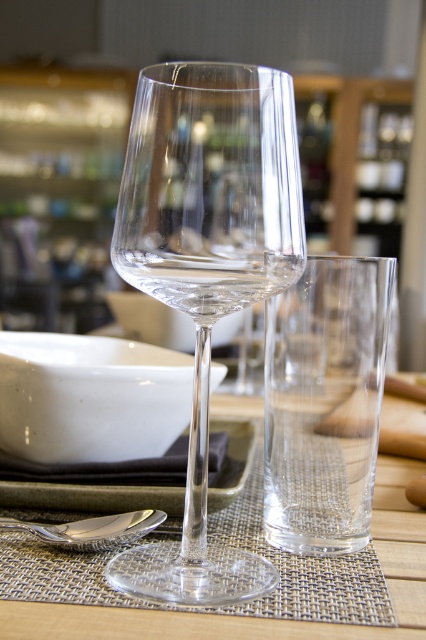
Question: Estimate the real-world distances between objects in this image. Which object is farther from the transparent glass wine glass at center?

Choices:
 (A) black fabric tray at center
 (B) transparent glass at center

Answer: (B)

Question: Is transparent glass wine glass at center to the left of black fabric tray at center from the viewer's perspective?

Choices:
 (A) no
 (B) yes

Answer: (A)

Question: Is black fabric tray at center further to camera compared to silver metallic spoon at lower left?

Choices:
 (A) no
 (B) yes

Answer: (B)

Question: Which object is the closest to the transparent glass wine glass at center?

Choices:
 (A) black fabric tray at center
 (B) silver metallic spoon at lower left

Answer: (B)

Question: Among these objects, which one is farthest from the camera?

Choices:
 (A) silver metallic spoon at lower left
 (B) transparent glass wine glass at center
 (C) black fabric tray at center

Answer: (C)

Question: Can you confirm if transparent glass wine glass at center is positioned to the left of transparent glass at center?

Choices:
 (A) yes
 (B) no

Answer: (A)